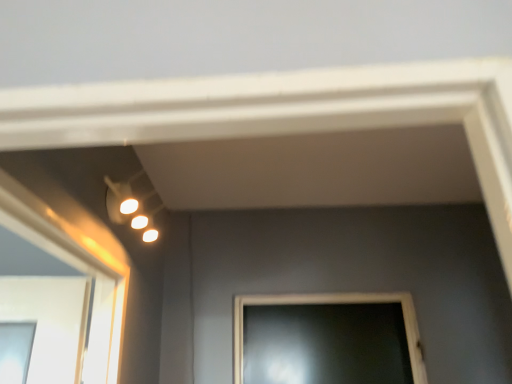
At what (x,y) coordinates should I click in order to perform the action: click on white glossy spotlights at upper center. Please return your answer as a coordinate pair (x, y). This screenshot has width=512, height=384. Looking at the image, I should click on (131, 207).

What do you see at coordinates (131, 207) in the screenshot?
I see `white glossy spotlights at upper center` at bounding box center [131, 207].

You are a GUI agent. You are given a task and a screenshot of the screen. Output one action in this format:
    pyautogui.click(x=<x>, y=<y>)
    Task: Click on the white glossy spotlights at upper center
    
    Given the screenshot: What is the action you would take?
    pyautogui.click(x=131, y=207)